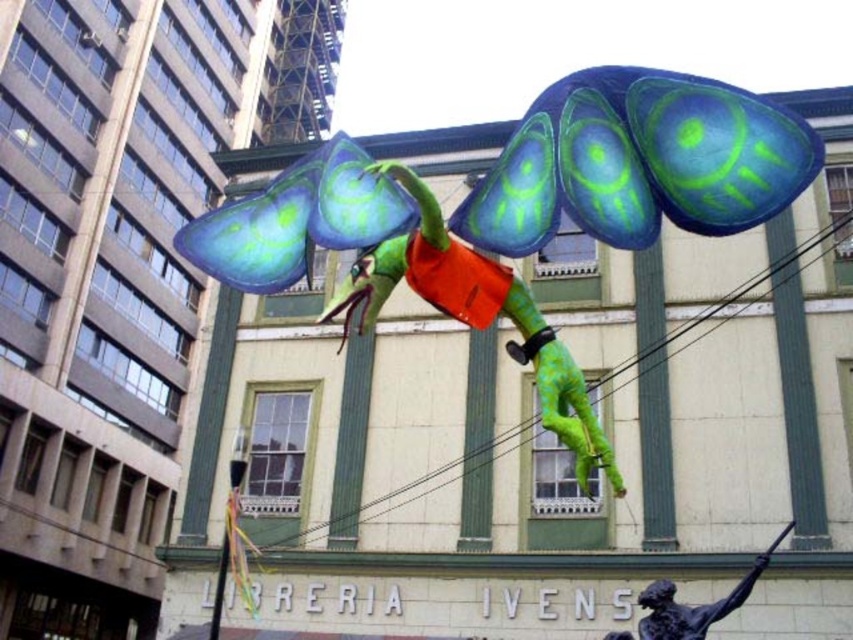
Is green matte sculpture at center positioned before bronze statue at lower right?

Yes, green matte sculpture at center is closer to the viewer.

Who is positioned more to the left, green matte sculpture at center or bronze statue at lower right?

green matte sculpture at center is more to the left.

Between point (416, 221) and point (712, 616), which one is positioned behind?

The point (712, 616) is more distant.

Locate an element on the screen. This screenshot has width=853, height=640. green matte sculpture at center is located at coordinates (476, 316).